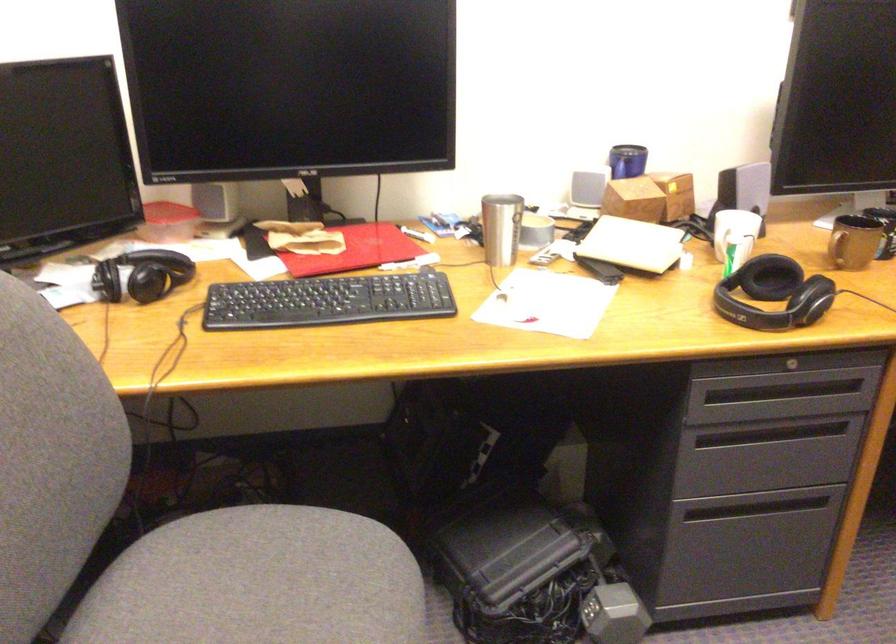
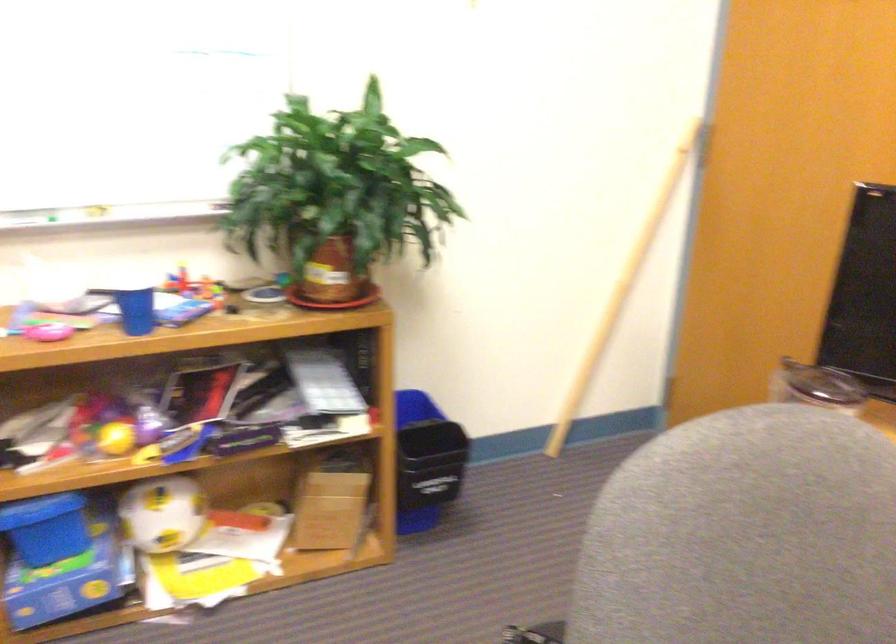
Question: The images are taken continuously from a first-person perspective. In which direction is your viewpoint rotating?

Choices:
 (A) Left
 (B) Right
 (C) Up
 (D) Down

Answer: (A)